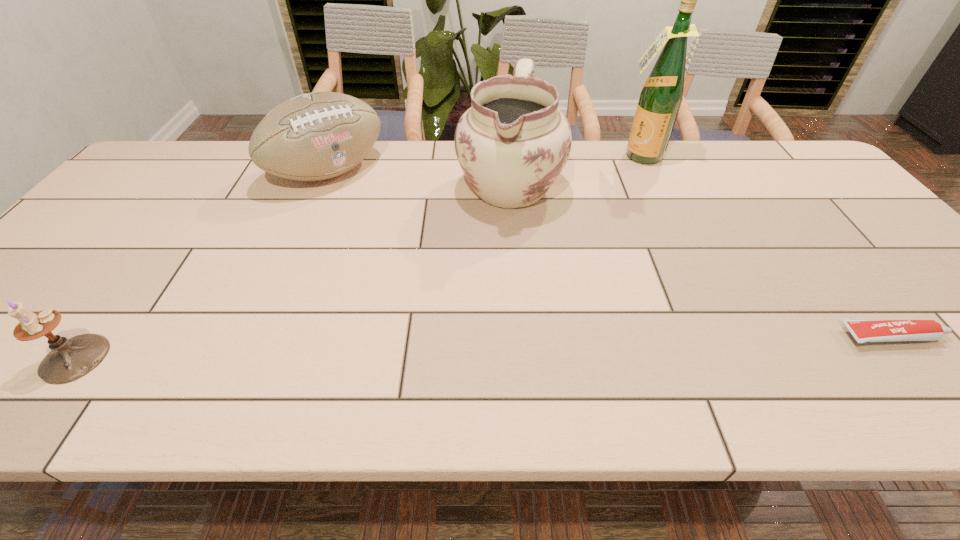
Select which object is the closest to the liquor. Please provide its 2D coordinates. Your answer should be formatted as a tuple, i.e. [(x, y)], where the tuple contains the x and y coordinates of a point satisfying the conditions above.

[(513, 142)]

This screenshot has height=540, width=960. Find the location of `vacant space that satisfies the following two spatial constraints: 1. on the back side of the second object from right to left; 2. on the right side of the third tallest object`. vacant space that satisfies the following two spatial constraints: 1. on the back side of the second object from right to left; 2. on the right side of the third tallest object is located at coordinates (336, 156).

This screenshot has width=960, height=540. In order to click on free spot that satisfies the following two spatial constraints: 1. on the front side of the toothpaste; 2. at the nozzle of the third shortest object in this screenshot , I will do `click(258, 336)`.